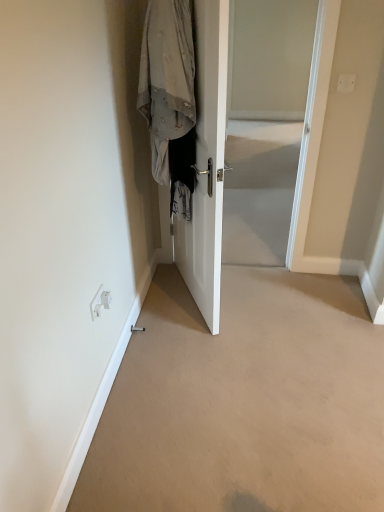
Question: From a real-world perspective, is white glossy door at center physically located above or below transparent glass door at center?

Choices:
 (A) above
 (B) below

Answer: (A)

Question: Considering the positions of white glossy door at center and transparent glass door at center in the image, is white glossy door at center wider or thinner than transparent glass door at center?

Choices:
 (A) thin
 (B) wide

Answer: (A)

Question: Based on their relative distances, which object is farther from the light gray fabric coat at center?

Choices:
 (A) beige carpet at lower center
 (B) white plastic electric outlet at lower left
 (C) white glossy door at center
 (D) transparent glass door at center

Answer: (D)

Question: Which of these objects is positioned farthest from the light gray fabric coat at center?

Choices:
 (A) beige carpet at lower center
 (B) white glossy door at center
 (C) white plastic electric outlet at lower left
 (D) transparent glass door at center

Answer: (D)